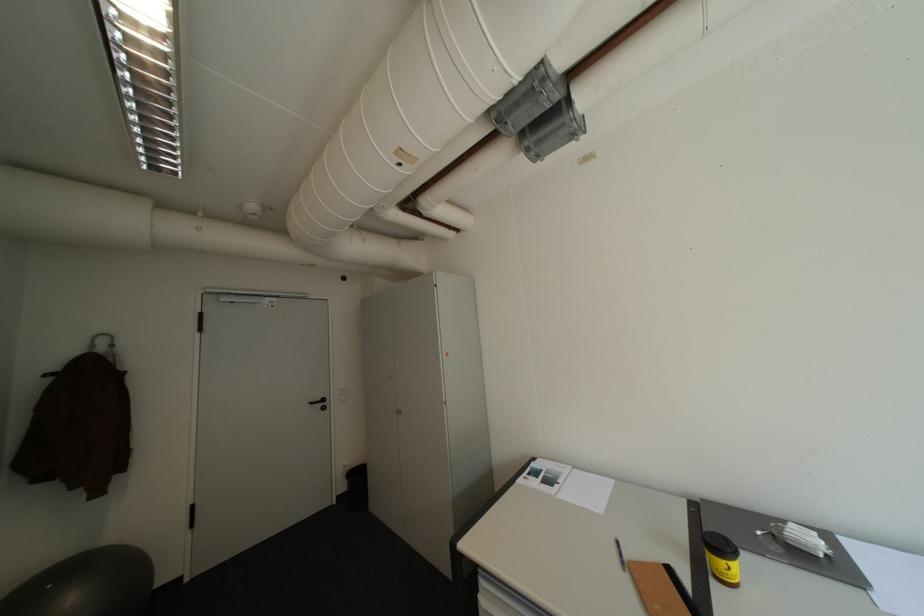
Which object does [87,585] point to?

It corresponds to the grey exercise ball in the image.